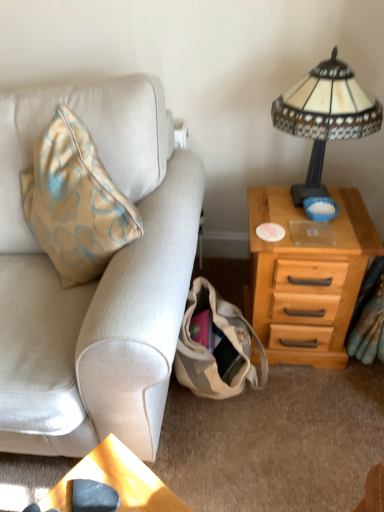
You are a GUI agent. You are given a task and a screenshot of the screen. Output one action in this format:
    pyautogui.click(x=<x>, y=<y>)
    Task: Click on the empty space that is ontop of wooden nightstand at right
    
    Given the screenshot: What is the action you would take?
    tap(305, 208)